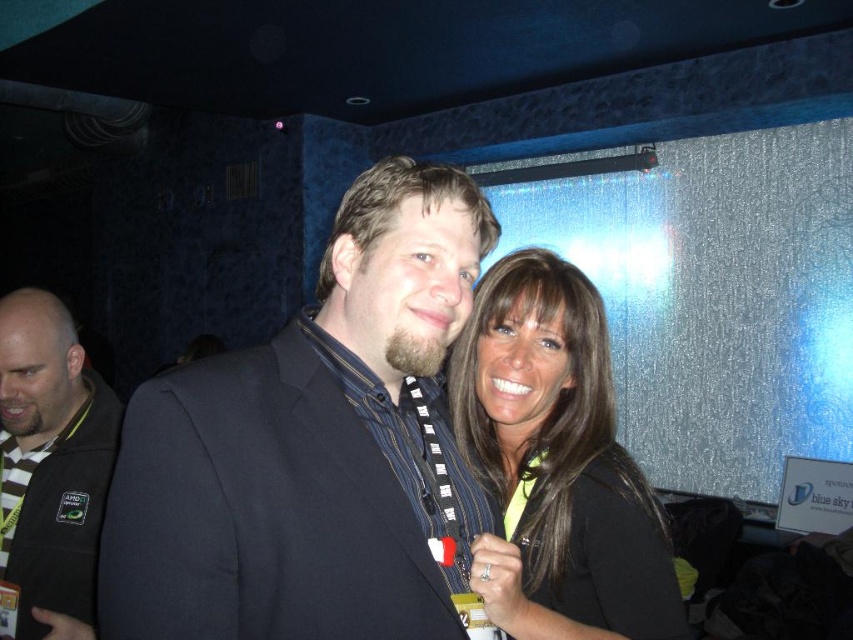
Question: Is matte black suit at center in front of matte black shirt at center?

Choices:
 (A) no
 (B) yes

Answer: (B)

Question: Can you confirm if matte black suit at center is positioned above matte black shirt at center?

Choices:
 (A) no
 (B) yes

Answer: (B)

Question: Is the position of matte black suit at center less distant than that of dark gray jacket at left?

Choices:
 (A) yes
 (B) no

Answer: (A)

Question: Which object appears farthest from the camera in this image?

Choices:
 (A) dark gray jacket at left
 (B) matte black suit at center

Answer: (A)

Question: Which of the following is the farthest from the observer?

Choices:
 (A) (541, 481)
 (B) (405, 448)

Answer: (A)

Question: Which object appears closest to the camera in this image?

Choices:
 (A) matte black shirt at center
 (B) dark gray jacket at left
 (C) matte black suit at center

Answer: (C)